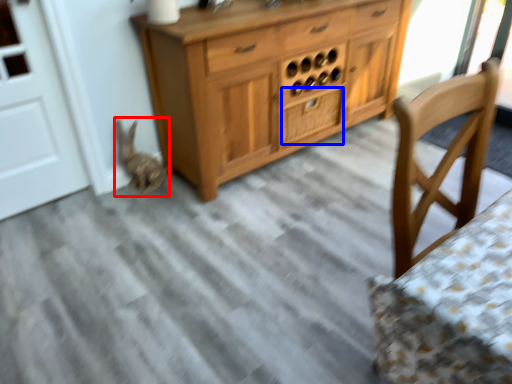
Question: Which object is further to the camera taking this photo, animal (highlighted by a red box) or drawer (highlighted by a blue box)?

Choices:
 (A) animal
 (B) drawer

Answer: (B)